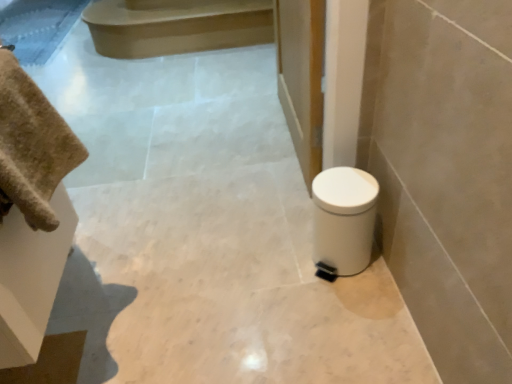
Question: From a real-world perspective, is beige cotton towel at left physically located above or below smooth beige stair at upper center?

Choices:
 (A) above
 (B) below

Answer: (A)

Question: From the image's perspective, is beige cotton towel at left above or below smooth beige stair at upper center?

Choices:
 (A) below
 (B) above

Answer: (A)

Question: Estimate the real-world distances between objects in this image. Which object is closer to the beige cotton towel at left?

Choices:
 (A) smooth beige stair at upper center
 (B) white plastic toilet at lower right

Answer: (B)

Question: Estimate the real-world distances between objects in this image. Which object is closer to the smooth beige stair at upper center?

Choices:
 (A) white plastic toilet at lower right
 (B) beige cotton towel at left

Answer: (A)